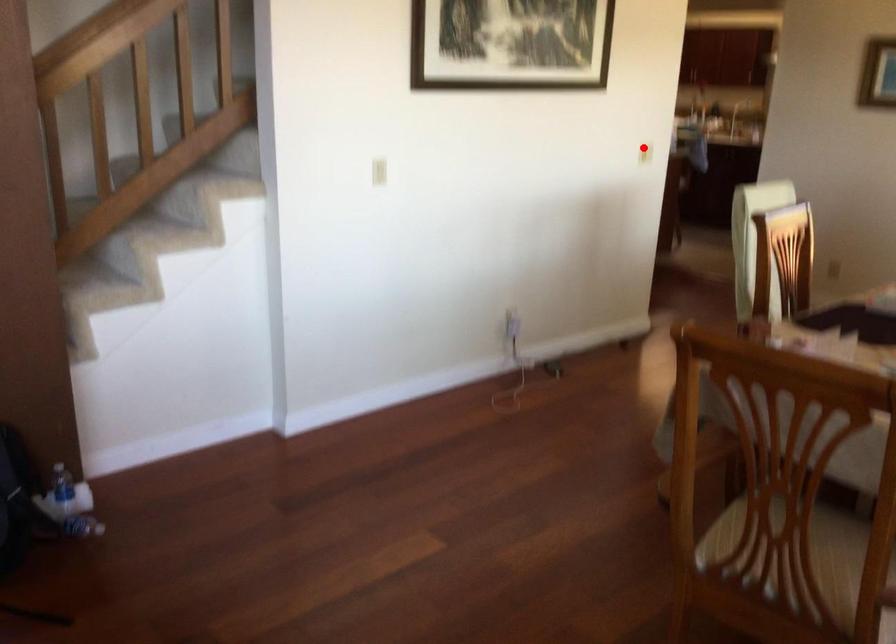
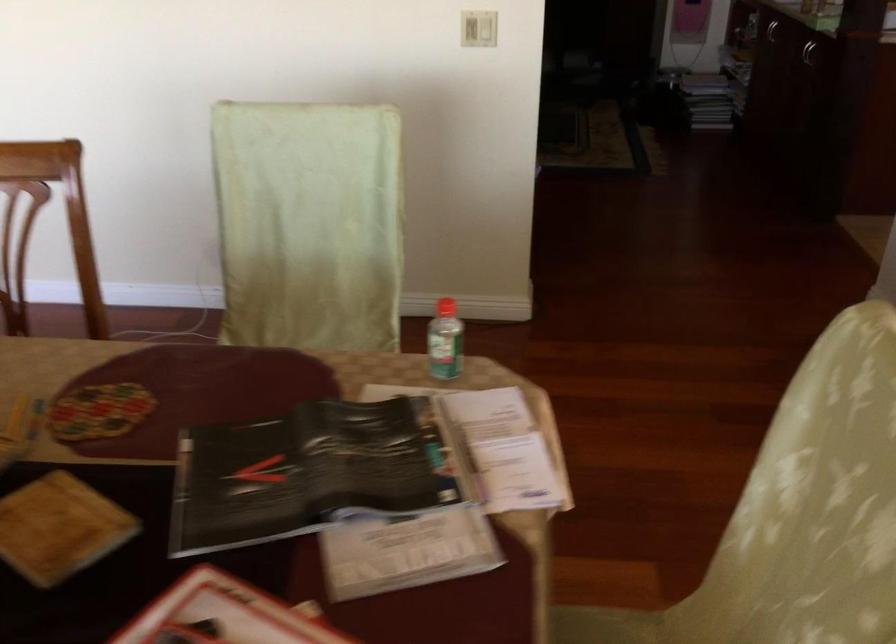
Find the pixel in the second image that matches the highlighted location in the first image.

(478, 29)